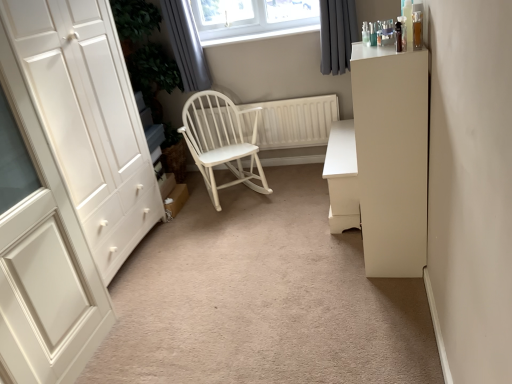
Consider the image. Measure the distance between dark grey fabric curtain at upper right, the second curtain when ordered from left to right, and camera.

dark grey fabric curtain at upper right, the second curtain when ordered from left to right, is 2.76 meters away from camera.

How much space does dark grey fabric curtain at upper right, the second curtain when ordered from left to right, occupy vertically?

dark grey fabric curtain at upper right, the second curtain when ordered from left to right, is 20.01 inches tall.

Locate an element on the screen. white wood radiator at center is located at coordinates (295, 121).

What do you see at coordinates (342, 177) in the screenshot? I see `white matte chest of drawers at center` at bounding box center [342, 177].

Consider the image. Measure the distance between point (329, 222) and camera.

Point (329, 222) is 8.35 feet away from camera.

Identify the location of white matte cabinet at right. The width and height of the screenshot is (512, 384). (391, 157).

Describe the element at coordinates (262, 298) in the screenshot. I see `white wood wardrobe at left` at that location.

You are a GUI agent. You are given a task and a screenshot of the screen. Output one action in this format:
    pyautogui.click(x=<x>, y=<y>)
    Task: Click on the dark grey fabric curtain at upper right, the second curtain when ordered from left to right
    
    Given the screenshot: What is the action you would take?
    pyautogui.click(x=337, y=34)

Would you consider white wood rocking chair at center to be distant from white painted wood wardrobe at left?

No, there isn't a large distance between white wood rocking chair at center and white painted wood wardrobe at left.

Who is shorter, white wood rocking chair at center or white painted wood wardrobe at left?

white wood rocking chair at center.

Considering the positions of objects white wood rocking chair at center and white painted wood wardrobe at left in the image provided, who is in front, white wood rocking chair at center or white painted wood wardrobe at left?

Positioned in front is white painted wood wardrobe at left.

How much distance is there between white wood rocking chair at center and white painted wood wardrobe at left?

white wood rocking chair at center is 83.29 centimeters away from white painted wood wardrobe at left.

From the picture: Can you confirm if white matte cabinet at right is positioned to the left of white wood wardrobe at left?

In fact, white matte cabinet at right is to the right of white wood wardrobe at left.

In the scene shown: Between white matte cabinet at right and white wood wardrobe at left, which one has larger size?

Bigger between the two is white wood wardrobe at left.

Is white matte cabinet at right not inside white wood wardrobe at left?

white matte cabinet at right is positioned outside white wood wardrobe at left.

Looking at this image, how many degrees apart are the facing directions of white matte cabinet at right and white wood wardrobe at left?

white matte cabinet at right and white wood wardrobe at left are facing 90.4 degrees away from each other.

At what (x,y) coordinates should I click in order to perform the action: click on plain below the white painted wood wardrobe at left (from a real-world perspective). Please return your answer as a coordinate pair (x, y). The width and height of the screenshot is (512, 384). Looking at the image, I should click on (262, 298).

Consider the image. From the image's perspective, is white wood wardrobe at left over white painted wood wardrobe at left?

Actually, white wood wardrobe at left appears below white painted wood wardrobe at left in the image.

From a real-world perspective, does white wood wardrobe at left sit lower than white painted wood wardrobe at left?

Yes, from a real-world perspective, white wood wardrobe at left is beneath white painted wood wardrobe at left.

Is white wood wardrobe at left taller or shorter than white painted wood wardrobe at left?

Considering their sizes, white wood wardrobe at left has less height than white painted wood wardrobe at left.

In the scene shown: Is white painted wood wardrobe at left positioned far away from white matte chest of drawers at center?

Yes, white painted wood wardrobe at left and white matte chest of drawers at center are located far from each other.

Considering the relative sizes of white painted wood wardrobe at left and white matte chest of drawers at center in the image provided, is white painted wood wardrobe at left smaller than white matte chest of drawers at center?

No.

Which is less distant, [93,148] or [347,180]?

Point [93,148] appears to be closer to the viewer than point [347,180].

Is white painted wood wardrobe at left facing away from white matte chest of drawers at center?

That's not correct — white painted wood wardrobe at left is not looking away from white matte chest of drawers at center.

Are white matte cabinet at right and white wood rocking chair at center far apart?

Yes, white matte cabinet at right is far from white wood rocking chair at center.

From a real-world perspective, is white matte cabinet at right located beneath white wood rocking chair at center?

Actually, white matte cabinet at right is physically above white wood rocking chair at center in the real world.

Is white matte cabinet at right bigger or smaller than white wood rocking chair at center?

Considering their sizes, white matte cabinet at right takes up less space than white wood rocking chair at center.

Find the location of a particular element. The image size is (512, 384). cabinetry in front of the white wood rocking chair at center is located at coordinates (391, 157).

Can you confirm if dark grey fabric curtain at upper right, the 1th curtain in the right-to-left sequence, is shorter than gray fabric curtain at upper center, which is counted as the second curtain, starting from the right?

Correct, dark grey fabric curtain at upper right, the 1th curtain in the right-to-left sequence, is not as tall as gray fabric curtain at upper center, which is counted as the second curtain, starting from the right.

From a real-world perspective, which is physically below, dark grey fabric curtain at upper right, the 1th curtain in the right-to-left sequence, or gray fabric curtain at upper center, which is counted as the second curtain, starting from the right?

dark grey fabric curtain at upper right, the 1th curtain in the right-to-left sequence, from a real-world perspective.

How many degrees apart are the facing directions of dark grey fabric curtain at upper right, the second curtain when ordered from left to right, and gray fabric curtain at upper center, which is counted as the second curtain, starting from the right?

The facing directions of dark grey fabric curtain at upper right, the second curtain when ordered from left to right, and gray fabric curtain at upper center, which is counted as the second curtain, starting from the right, are 0.745 degrees apart.

Is white painted wood wardrobe at left positioned with its back to gray fabric curtain at upper center, which is counted as the second curtain, starting from the right?

No, white painted wood wardrobe at left is not facing the opposite direction of gray fabric curtain at upper center, which is counted as the second curtain, starting from the right.

Is white painted wood wardrobe at left at the left side of gray fabric curtain at upper center, which is counted as the second curtain, starting from the right?

Correct, you'll find white painted wood wardrobe at left to the left of gray fabric curtain at upper center, which is counted as the second curtain, starting from the right.

Who is smaller, white painted wood wardrobe at left or gray fabric curtain at upper center, which is counted as the second curtain, starting from the right?

Smaller between the two is gray fabric curtain at upper center, which is counted as the second curtain, starting from the right.

Which object is further away from the camera taking this photo, white painted wood wardrobe at left or gray fabric curtain at upper center, which is counted as the second curtain, starting from the right?

gray fabric curtain at upper center, which is counted as the second curtain, starting from the right, is behind.

Find the location of a particular element. cupboard in front of the white wood rocking chair at center is located at coordinates (71, 181).

In the image, there is a white wood wardrobe at left. Identify the location of cabinetry above it (from the image's perspective). (391, 157).

Estimate the real-world distances between objects in this image. Which object is closer to white painted wood wardrobe at left, white matte chest of drawers at center or white matte cabinet at right?

The object closer to white painted wood wardrobe at left is white matte chest of drawers at center.

Considering their positions, is white matte chest of drawers at center positioned closer to white wood rocking chair at center than white wood wardrobe at left?

Among the two, white wood wardrobe at left is located nearer to white wood rocking chair at center.

When comparing their distances from white wood wardrobe at left, does dark grey fabric curtain at upper right, the 1th curtain in the right-to-left sequence, or white matte cabinet at right seem further?

dark grey fabric curtain at upper right, the 1th curtain in the right-to-left sequence.

Considering their positions, is white painted wood wardrobe at left positioned closer to dark grey fabric curtain at upper right, the 1th curtain in the right-to-left sequence, than white matte cabinet at right?

white matte cabinet at right is positioned closer to the anchor dark grey fabric curtain at upper right, the 1th curtain in the right-to-left sequence.

When comparing their distances from white wood radiator at center, does white wood rocking chair at center or gray fabric curtain at upper center, which is counted as the second curtain, starting from the right, seem closer?

white wood rocking chair at center lies closer to white wood radiator at center than the other object.

Looking at the image, which one is located closer to dark grey fabric curtain at upper right, the second curtain when ordered from left to right, white matte chest of drawers at center or white wood radiator at center?

The object closer to dark grey fabric curtain at upper right, the second curtain when ordered from left to right, is white wood radiator at center.

Looking at the image, which one is located further to dark grey fabric curtain at upper right, the 1th curtain in the right-to-left sequence, gray fabric curtain at upper center, which is counted as the second curtain, starting from the right, or white matte cabinet at right?

Among the two, white matte cabinet at right is located further to dark grey fabric curtain at upper right, the 1th curtain in the right-to-left sequence.

Estimate the real-world distances between objects in this image. Which object is closer to white wood radiator at center, white matte chest of drawers at center or dark grey fabric curtain at upper right, the second curtain when ordered from left to right?

dark grey fabric curtain at upper right, the second curtain when ordered from left to right.

Find the location of `the chest of drawers positioned between white matte cabinet at right and dark grey fabric curtain at upper right, the second curtain when ordered from left to right, from near to far`. the chest of drawers positioned between white matte cabinet at right and dark grey fabric curtain at upper right, the second curtain when ordered from left to right, from near to far is located at coordinates (342, 177).

Find the location of a particular element. The image size is (512, 384). chair between white painted wood wardrobe at left and dark grey fabric curtain at upper right, the 1th curtain in the right-to-left sequence is located at coordinates (221, 141).

Identify the location of plain between white painted wood wardrobe at left and white matte chest of drawers at center. (262, 298).

You are a GUI agent. You are given a task and a screenshot of the screen. Output one action in this format:
    pyautogui.click(x=<x>, y=<y>)
    Task: Click on the cupboard located between white wood wardrobe at left and white wood rocking chair at center in the depth direction
    
    Given the screenshot: What is the action you would take?
    pyautogui.click(x=71, y=181)